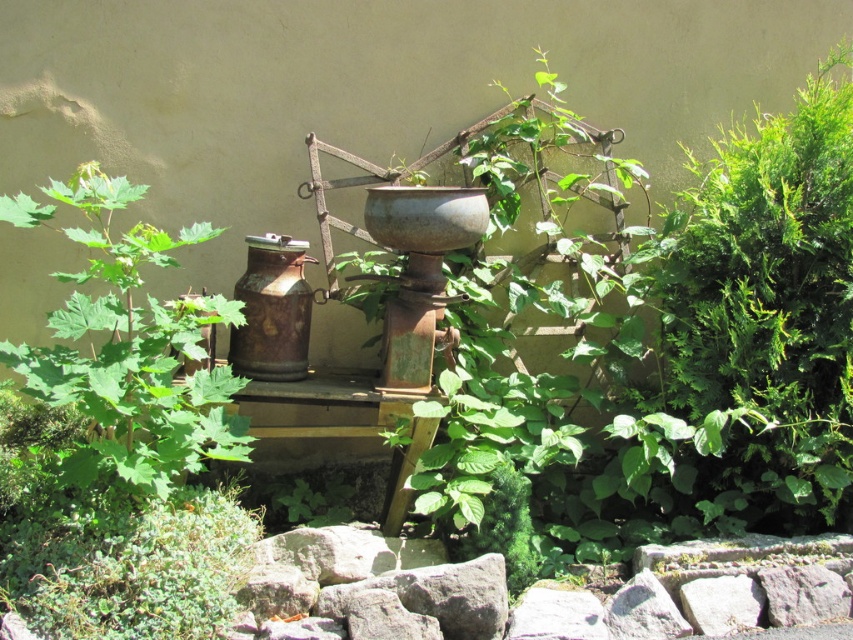
Which is more to the right, green leafy bush at right or green leafy plant at left?

green leafy bush at right is more to the right.

Can you confirm if green leafy bush at right is wider than green leafy plant at left?

Yes.

Is point (763, 280) more distant than point (169, 436)?

Yes, it is.

Find the location of a particular element. The image size is (853, 640). green leafy bush at right is located at coordinates (767, 308).